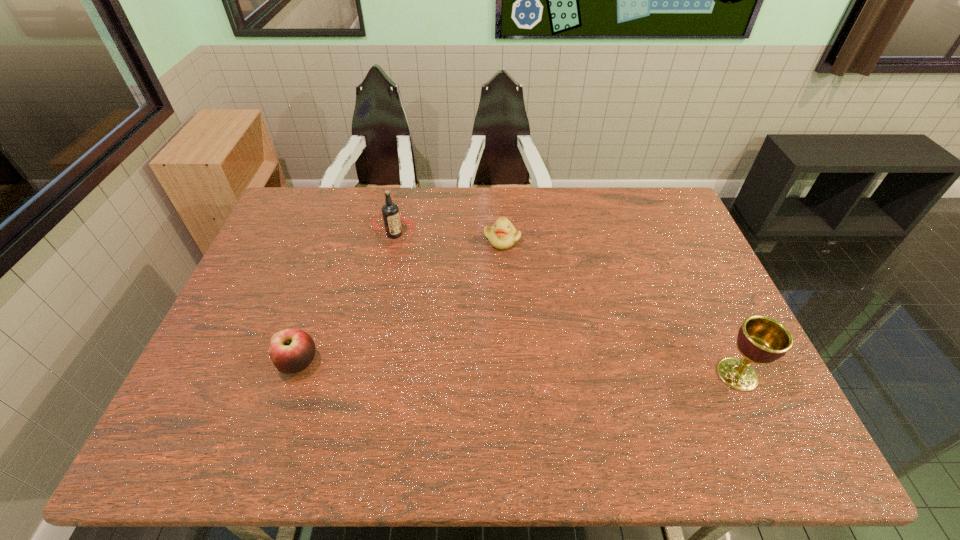
Where is `vacant area in the image that satisfies the following two spatial constraints: 1. on the back side of the third tallest object; 2. on the left side of the second object from left to right`? The height and width of the screenshot is (540, 960). vacant area in the image that satisfies the following two spatial constraints: 1. on the back side of the third tallest object; 2. on the left side of the second object from left to right is located at coordinates point(342,234).

The height and width of the screenshot is (540, 960). What are the coordinates of `free space that satisfies the following two spatial constraints: 1. on the front side of the rightmost object; 2. on the right side of the shortest object` in the screenshot? It's located at (509, 374).

At what (x,y) coordinates should I click in order to perform the action: click on free space in the image that satisfies the following two spatial constraints: 1. on the front side of the chalice; 2. on the left side of the apple. Please return your answer as a coordinate pair (x, y). The width and height of the screenshot is (960, 540). Looking at the image, I should click on (296, 374).